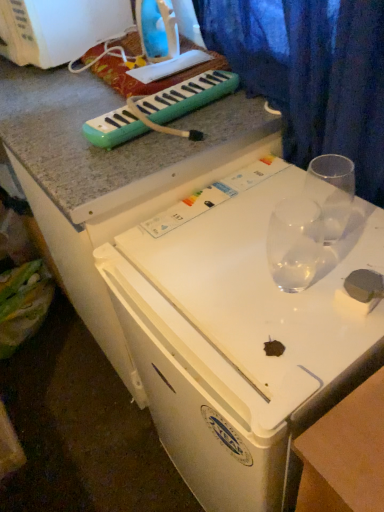
This screenshot has height=512, width=384. In order to click on free space to the left of transparent glass at upper right, the 2th martini glass viewed from the left in this screenshot , I will do `click(237, 251)`.